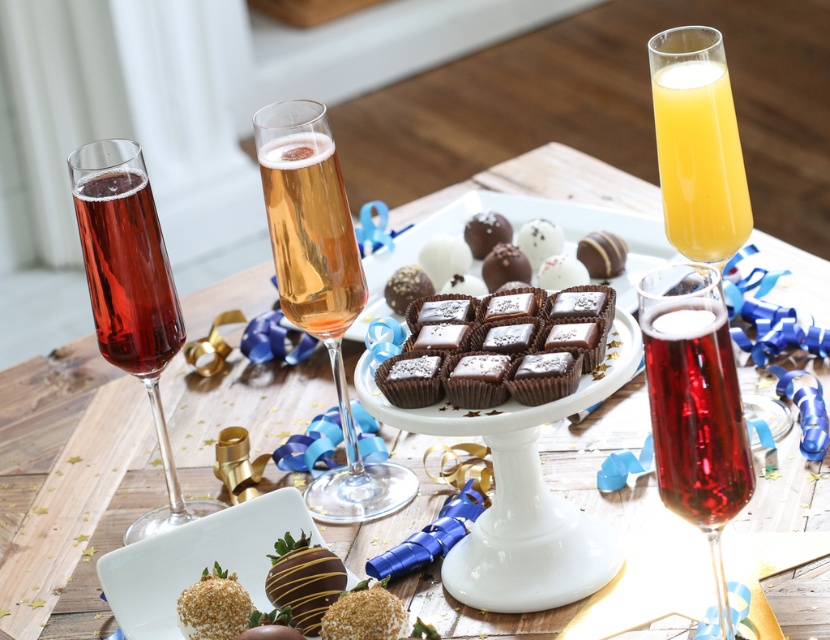
Question: Estimate the real-world distances between objects in this image. Which object is closer to the matte glass wine at left?

Choices:
 (A) matte glass wine at center
 (B) translucent glass orange juice at upper right
 (C) chocolate-coated truffle at center

Answer: (A)

Question: Which of these objects is positioned farthest from the chocolate-coated truffle at center?

Choices:
 (A) translucent glass champagne flute at center
 (B) golden bubbly champagne at center
 (C) translucent glass orange juice at upper right
 (D) matte glass wine at center

Answer: (D)

Question: Based on their relative distances, which object is nearer to the translucent glass champagne flute at center?

Choices:
 (A) translucent glass orange juice at upper right
 (B) matte glass wine at center

Answer: (A)

Question: Is translucent glass champagne flute at center thinner than chocolate-coated truffle at center?

Choices:
 (A) yes
 (B) no

Answer: (B)

Question: Can you confirm if matte glass wine at center is smaller than matte glass wine at left?

Choices:
 (A) no
 (B) yes

Answer: (B)

Question: Is translucent glass flute at upper right wider than chocolate-coated truffle at center?

Choices:
 (A) no
 (B) yes

Answer: (B)